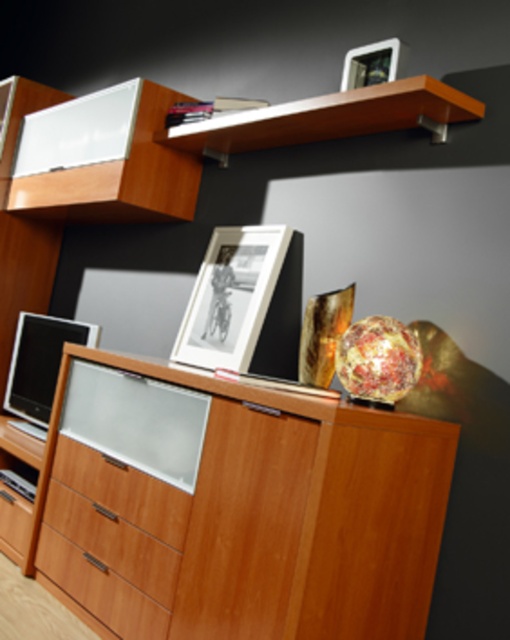
Is wooden dresser at center thinner than wooden drawer at lower left?

No.

Between point (395, 472) and point (113, 468), which one is positioned behind?

The point (113, 468) is behind.

Between point (373, 419) and point (182, 548), which one is positioned in front?

Point (373, 419)

Identify the location of wooden dresser at center. (250, 518).

Is wooden dresser at center bigger than matte black frame at upper center?

Correct, wooden dresser at center is larger in size than matte black frame at upper center.

Can you confirm if wooden dresser at center is positioned above matte black frame at upper center?

Actually, wooden dresser at center is below matte black frame at upper center.

Is point (414, 502) positioned before point (205, 289)?

Yes, it is.

This screenshot has height=640, width=510. In order to click on wooden dresser at center in this screenshot , I will do `click(250, 518)`.

Is matte white cabinet at upper left positioned before matte black picture frame at upper center?

No, matte white cabinet at upper left is behind matte black picture frame at upper center.

From the picture: Is matte white cabinet at upper left to the left of matte black picture frame at upper center from the viewer's perspective?

Indeed, matte white cabinet at upper left is positioned on the left side of matte black picture frame at upper center.

What do you see at coordinates (112, 164) in the screenshot? I see `matte white cabinet at upper left` at bounding box center [112, 164].

Locate an element on the screen. Image resolution: width=510 pixels, height=640 pixels. matte white cabinet at upper left is located at coordinates (112, 164).